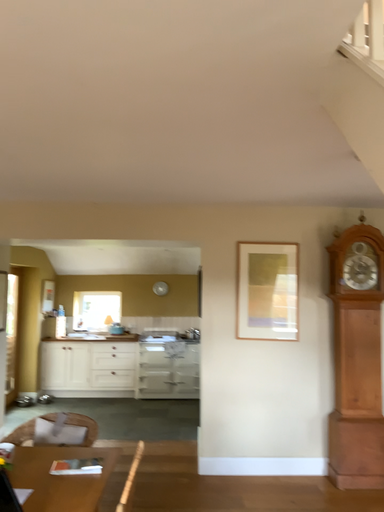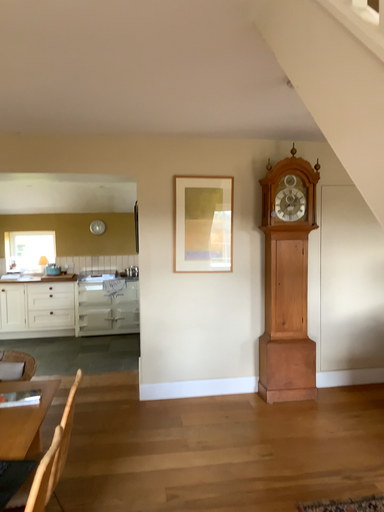
Question: Which way did the camera rotate in the video?

Choices:
 (A) rotated right
 (B) rotated left

Answer: (A)